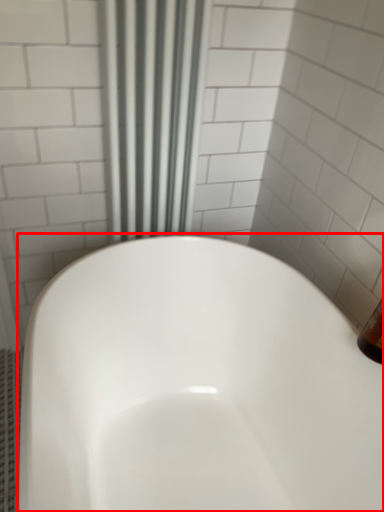
Question: From the image's perspective, where is bathtub (annotated by the red box) located relative to shower curtain?

Choices:
 (A) above
 (B) below

Answer: (B)